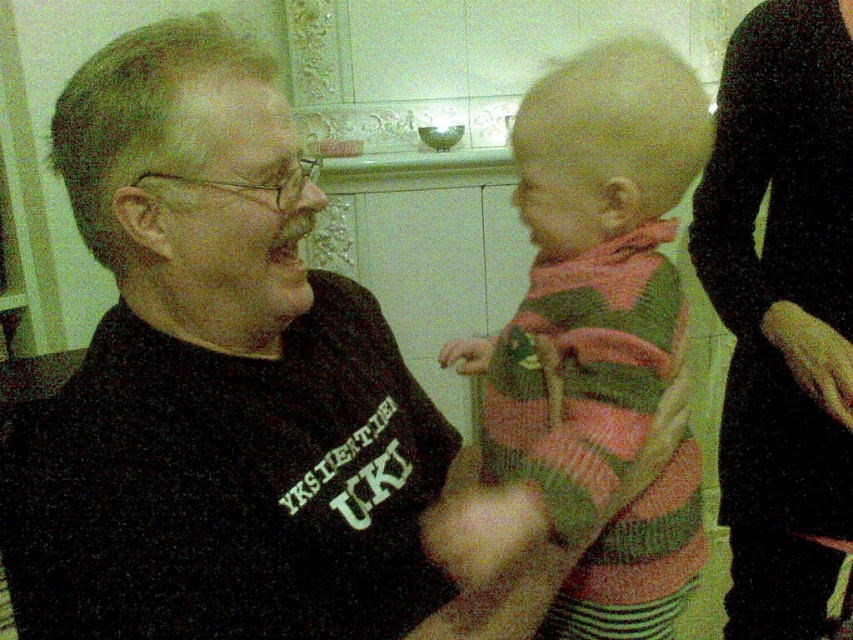
In the scene shown: You are a fashion designer who wants to create a new collection inspired by the clothing items in the image. Which item is wider, the knitted sweater at center or the black fabric dress at right?

The knitted sweater at center might be wider than the black fabric dress at right according to the description.

You are a photographer trying to capture a candid shot of the knitted sweater at center and the black fabric dress at right. Which object should you focus on first to ensure both are in sharp focus?

The knitted sweater at center is closer to the viewer than the black fabric dress at right. To ensure both are in sharp focus, focus on the knitted sweater at center first since it is closer, and the depth of field will naturally include the black fabric dress at right in the background.

You are a tailor who needs to measure the distance between the knitted sweater at center and the edge of the table it is placed on. However, you can only use a ruler that measures up to 20 inches. Can you accurately measure the distance using the ruler?

The knitted sweater at center is 25.60 inches from viewer, which is beyond the ruler capacity of 20 inches. Therefore, the tailor cannot accurately measure the distance with the provided ruler.